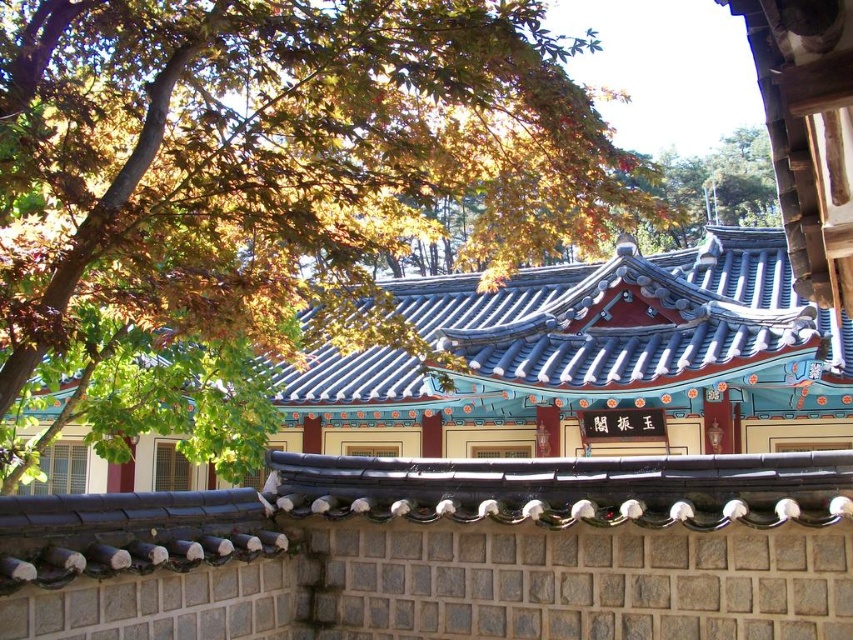
Who is positioned more to the left, blue glazed tile roof at center or green leafy tree at upper left?

Positioned to the left is blue glazed tile roof at center.

Does point (573, 605) come behind point (223, 22)?

That is True.

At what (x,y) coordinates should I click in order to perform the action: click on blue glazed tile roof at center. Please return your answer as a coordinate pair (x, y). Looking at the image, I should click on point(503,480).

I want to click on blue glazed tile roof at center, so click(503, 480).